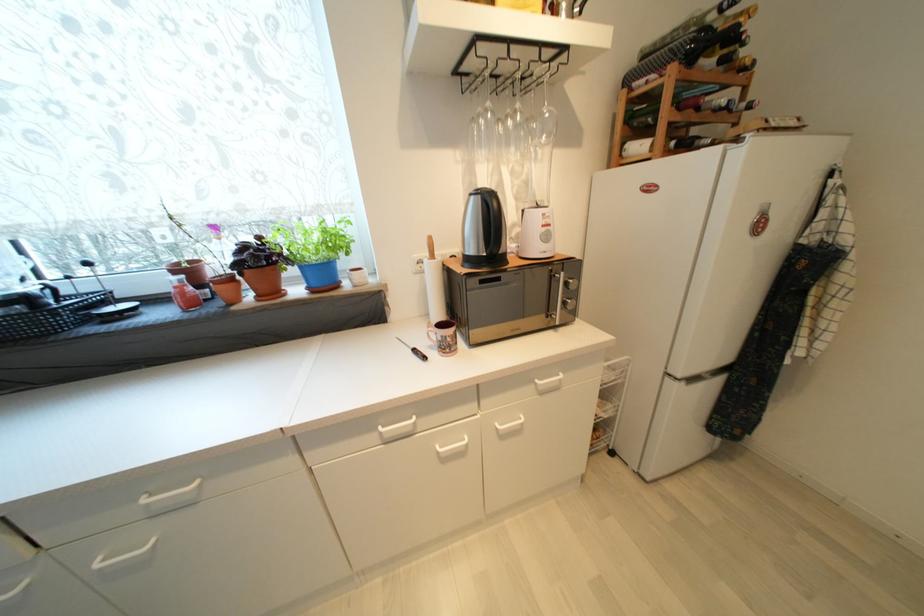
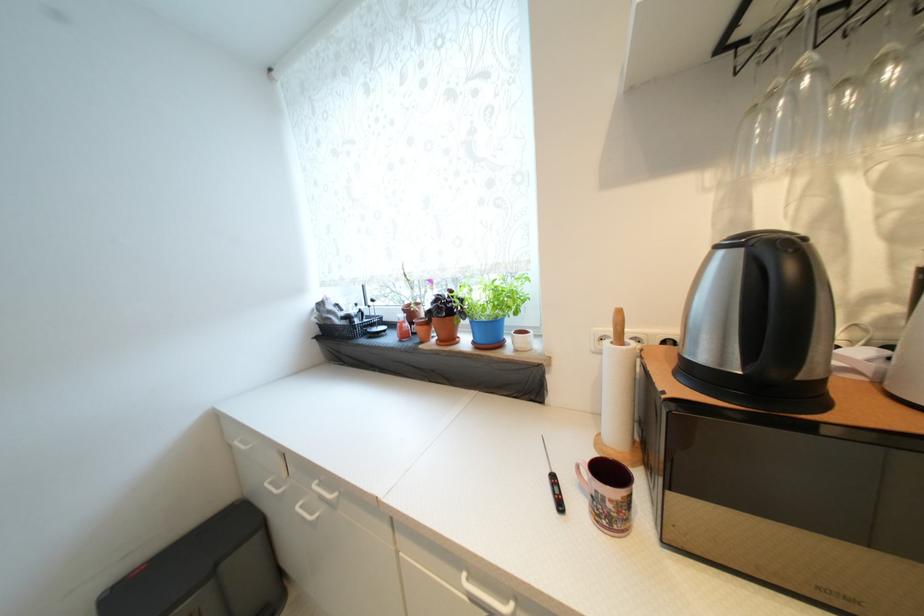
Locate, in the second image, the point that corresponds to [476,197] in the first image.

(723, 249)